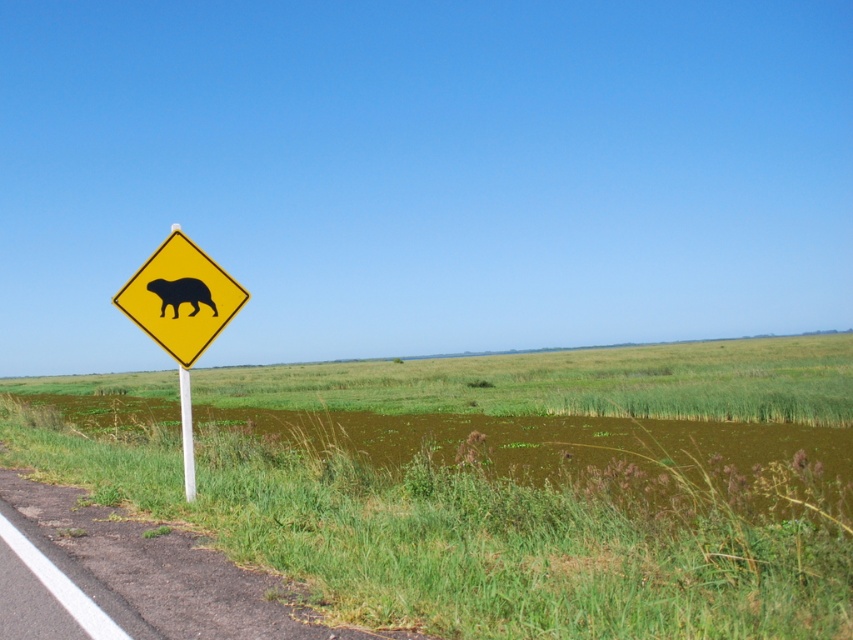
Question: From the image, what is the correct spatial relationship of yellow plastic diamond at left in relation to white plastic pole at left?

Choices:
 (A) below
 (B) above

Answer: (B)

Question: Which of the following is the farthest from the observer?

Choices:
 (A) (184, 484)
 (B) (194, 285)

Answer: (A)

Question: Which object is closer to the camera taking this photo?

Choices:
 (A) yellow plastic diamond at left
 (B) white plastic pole at left
 (C) black matte bear at left

Answer: (A)

Question: Which point is closer to the camera?

Choices:
 (A) (223, 314)
 (B) (213, 307)

Answer: (B)

Question: Does yellow plastic diamond at left lie behind black matte bear at left?

Choices:
 (A) no
 (B) yes

Answer: (A)

Question: Can you confirm if yellow plastic diamond at left is positioned to the left of black matte bear at left?

Choices:
 (A) yes
 (B) no

Answer: (A)